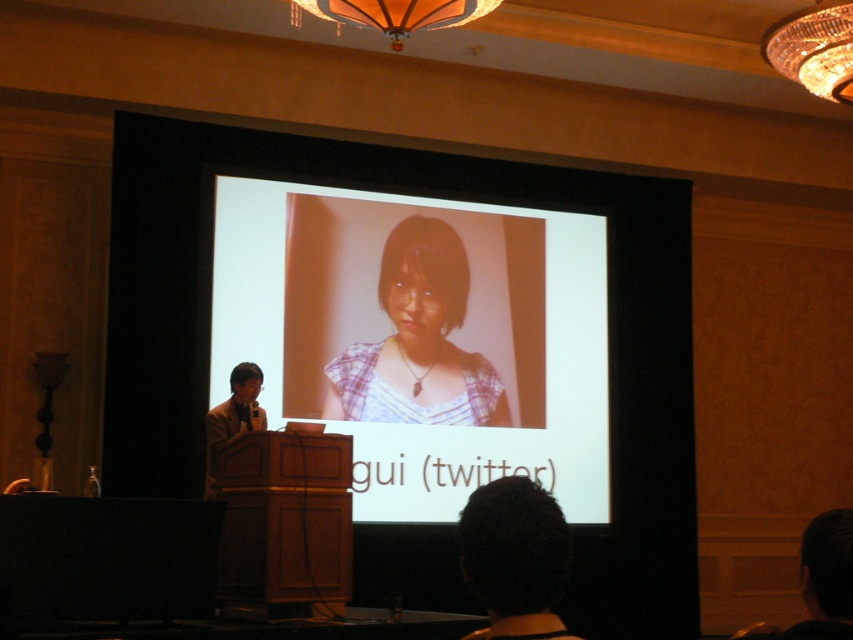
Which is in front, point (405, 317) or point (780, 22)?

Positioned in front is point (780, 22).

Which of these two, plaid fabric at center or crystal chandelier at upper right, stands taller?

plaid fabric at center is taller.

Where is `plaid fabric at center`? plaid fabric at center is located at coordinates (418, 340).

Can you confirm if plaid fabric at center is bigger than orange fabric chandelier at upper center?

Indeed, plaid fabric at center has a larger size compared to orange fabric chandelier at upper center.

Where is `plaid fabric at center`? Image resolution: width=853 pixels, height=640 pixels. plaid fabric at center is located at coordinates (418, 340).

Between crystal chandelier at upper right and orange fabric chandelier at upper center, which one is positioned lower?

crystal chandelier at upper right is below.

Who is higher up, crystal chandelier at upper right or orange fabric chandelier at upper center?

Positioned higher is orange fabric chandelier at upper center.

Does point (828, 81) come closer to viewer compared to point (370, 1)?

No, (828, 81) is further to viewer.

At what (x,y) coordinates should I click in order to perform the action: click on crystal chandelier at upper right. Please return your answer as a coordinate pair (x, y). Looking at the image, I should click on (814, 51).